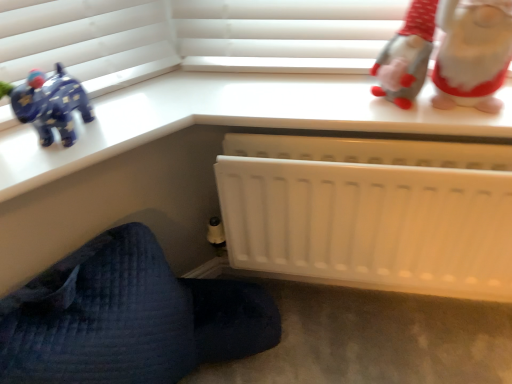
What are the coordinates of `free space to the left of white plush gnome at upper right` in the screenshot? It's located at (337, 99).